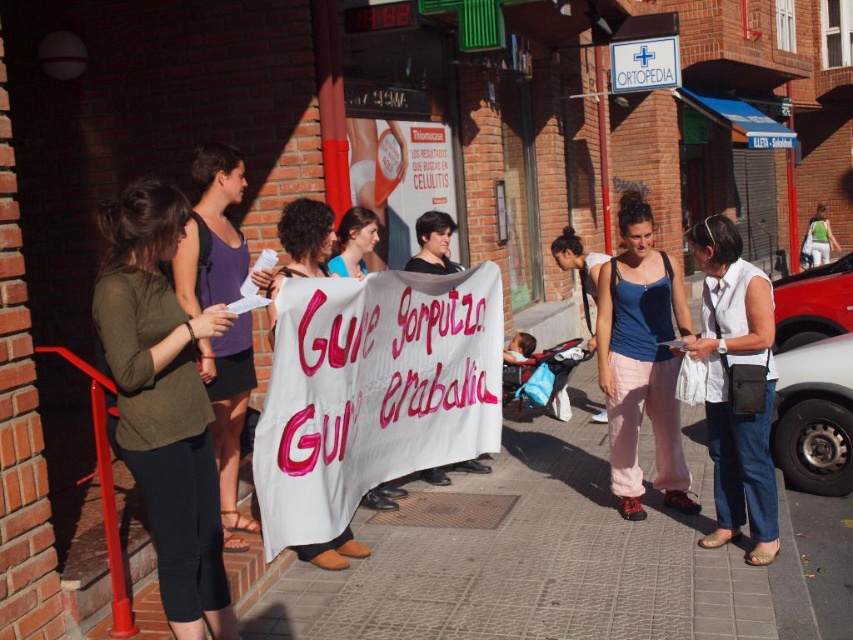
You are a photographer trying to capture a clear image of both the white cotton shirt at center and the matte purple tank top at left. Since you want to ensure both are visible, which clothing item should you focus on first considering their sizes?

The white cotton shirt at center is larger in size than the matte purple tank top at left, so you should focus on the white cotton shirt at center first to ensure it is in clear focus before adjusting for the smaller matte purple tank top at left.

You are a photographer trying to capture both the matte purple tank top at left and the white plastic sign at upper center in a single frame. Considering their sizes, which object will appear larger in the photo?

The matte purple tank top at left will appear larger in the photo because it is bigger than the white plastic sign at upper center according to the description.